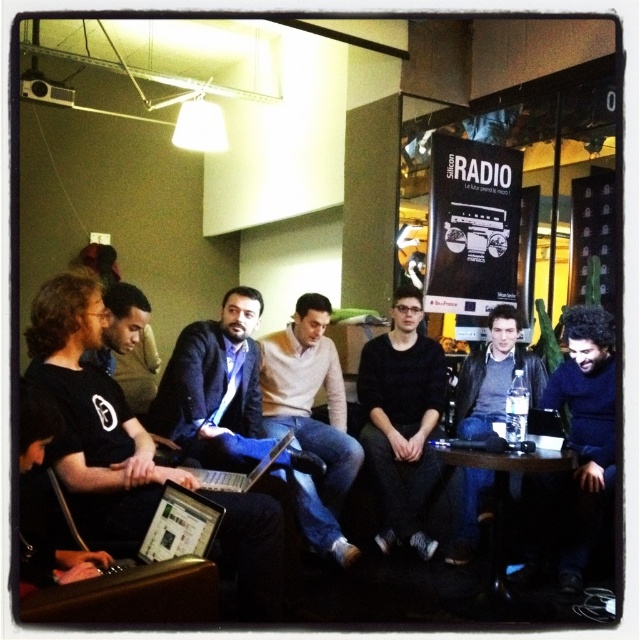
Between matte black jacket at center and dark gray leather jacket at center, which one is positioned higher?

Positioned higher is matte black jacket at center.

Between point (221, 428) and point (468, 394), which one is positioned behind?

The point (468, 394) is behind.

Find the location of `matte black jacket at center`. matte black jacket at center is located at coordinates (214, 387).

Based on the photo, does dark blue sweater at lower right have a smaller size compared to silver metallic laptop at center?

Incorrect, dark blue sweater at lower right is not smaller in size than silver metallic laptop at center.

Is dark blue sweater at lower right behind silver metallic laptop at center?

That is True.

Is point (576, 321) closer to viewer compared to point (268, 451)?

No, it is behind (268, 451).

At what (x,y) coordinates should I click in order to perform the action: click on dark blue sweater at lower right. Please return your answer as a coordinate pair (x, y). This screenshot has width=640, height=640. Looking at the image, I should click on (577, 445).

Measure the distance from light brown sweater at center to silver metallic laptop at center.

light brown sweater at center is 22.83 inches from silver metallic laptop at center.

Who is higher up, light brown sweater at center or silver metallic laptop at center?

light brown sweater at center is above.

The height and width of the screenshot is (640, 640). Find the location of `light brown sweater at center`. light brown sweater at center is located at coordinates (310, 419).